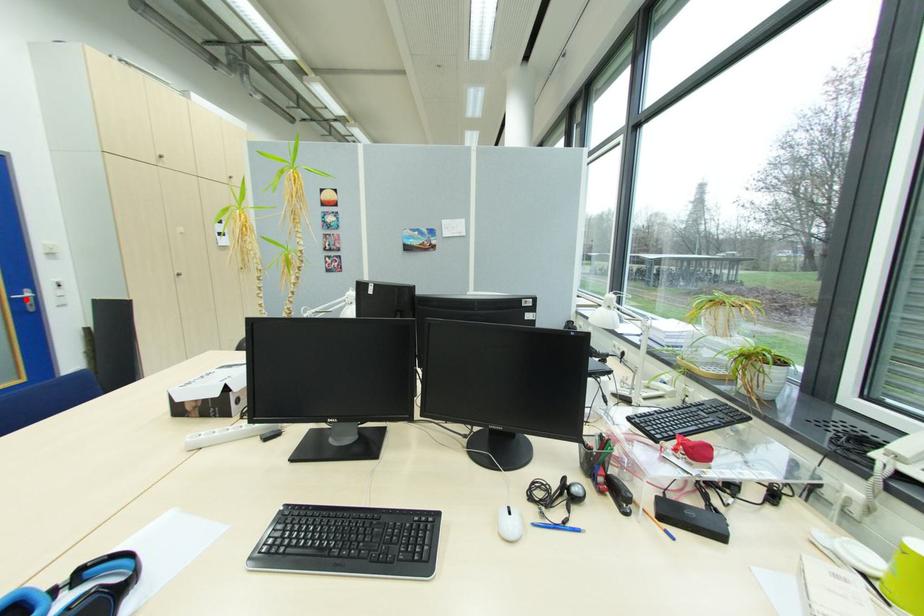
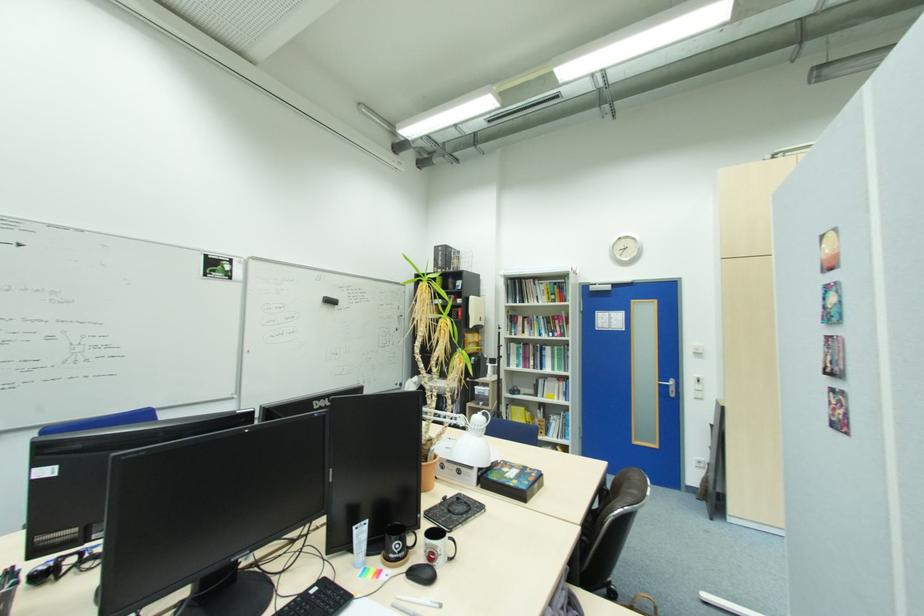
Question: I am providing you with two images of the same scene from different viewpoints. A red point is shown in image1. For the corresponding object point in image2, is it positioned nearer or farther from the camera?

Choices:
 (A) Nearer
 (B) Farther

Answer: (A)